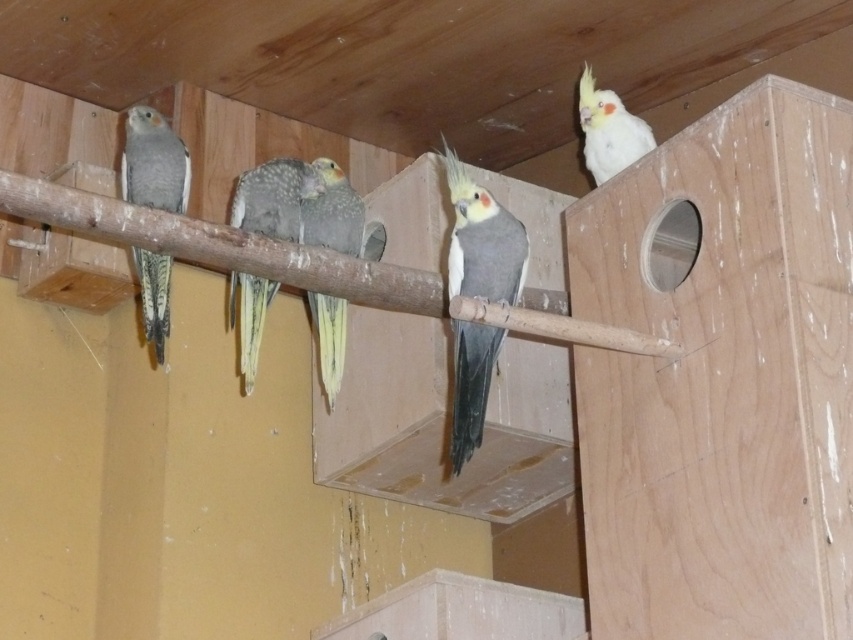
Question: Where is gray matte parrot at center located in relation to gray matte parrot at left in the image?

Choices:
 (A) right
 (B) left

Answer: (A)

Question: Among these objects, which one is nearest to the camera?

Choices:
 (A) gray matte parrot at left
 (B) white matte parrot at upper right

Answer: (A)

Question: Is speckled feathered parrot at center bigger than speckled gray parrot at center?

Choices:
 (A) yes
 (B) no

Answer: (A)

Question: Among these objects, which one is nearest to the camera?

Choices:
 (A) white matte parrot at upper right
 (B) speckled feathered parrot at center
 (C) gray matte parrot at center

Answer: (C)

Question: Which of the following is the farthest from the observer?

Choices:
 (A) (614, 136)
 (B) (239, 227)
 (C) (332, 348)

Answer: (A)

Question: Can you confirm if gray matte parrot at center is thinner than white matte parrot at upper right?

Choices:
 (A) yes
 (B) no

Answer: (B)